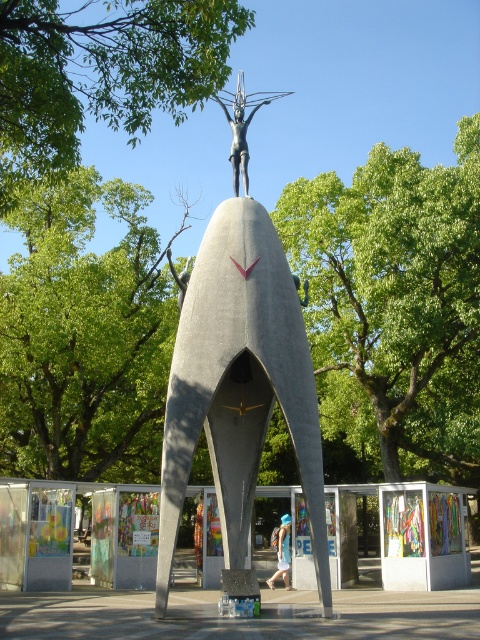
Based on the photo, you are an artist planning to photograph the polished bronze statue at center and the green leafy tree at upper center. Which object would you need to adjust your camera angle to capture fully in the frame?

The green leafy tree at upper center might be wider than the polished bronze statue at center, so you would need to adjust your camera angle to capture the entire width of the tree.

What is located at the point with coordinates (101, 74) in the image?

At point (101, 74) lies green leafy tree at upper center.